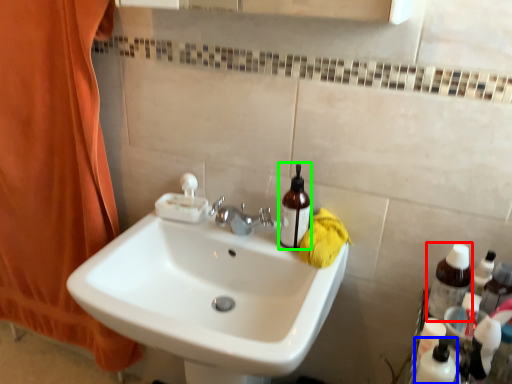
Question: Which is nearer to the bottle (highlighted by a red box)? toiletry (highlighted by a blue box) or mouthwash (highlighted by a green box).

Choices:
 (A) toiletry
 (B) mouthwash

Answer: (A)